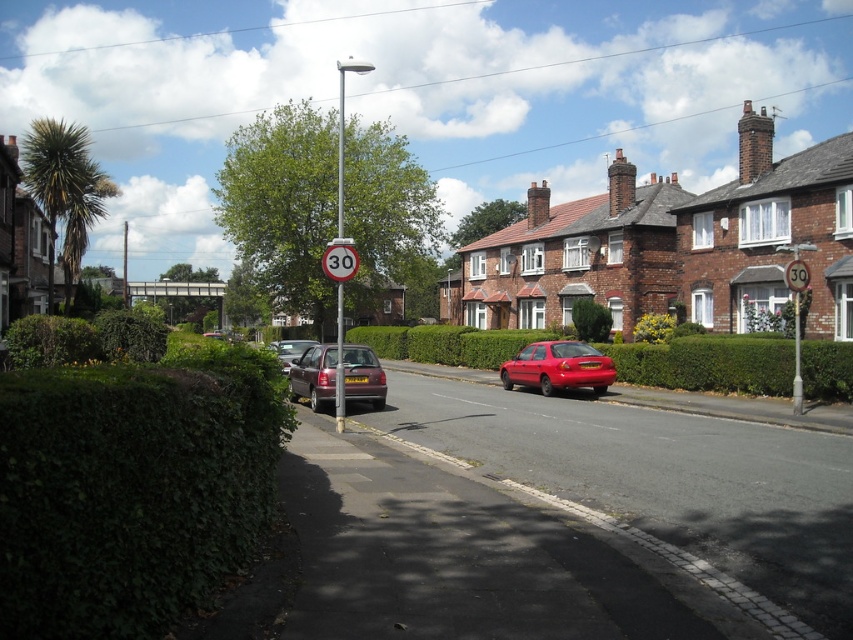
Can you confirm if metallic red speed limit sign at center is positioned to the left of metallic circular sign at center?

Indeed, metallic red speed limit sign at center is positioned on the left side of metallic circular sign at center.

Can you confirm if metallic red speed limit sign at center is positioned above metallic circular sign at center?

Incorrect, metallic red speed limit sign at center is not positioned above metallic circular sign at center.

Locate an element on the screen. Image resolution: width=853 pixels, height=640 pixels. metallic red speed limit sign at center is located at coordinates (339, 260).

Does matte red sedan at center come behind metallic red speed limit sign at center?

Yes, it is.

Who is more forward, [599,376] or [328,248]?

Point [328,248]

Find the location of a particular element. This screenshot has width=853, height=640. matte red sedan at center is located at coordinates (558, 368).

Does metallic silver car at center have a lesser width compared to metallic circular sign at center?

No, metallic silver car at center is not thinner than metallic circular sign at center.

From the picture: Who is taller, metallic silver car at center or metallic circular sign at center?

metallic silver car at center is taller.

Is point (270, 342) closer to viewer compared to point (805, 285)?

No, (270, 342) is behind (805, 285).

You are a GUI agent. You are given a task and a screenshot of the screen. Output one action in this format:
    pyautogui.click(x=<x>, y=<y>)
    Task: Click on the metallic silver car at center
    Image resolution: width=853 pixels, height=640 pixels.
    Given the screenshot: What is the action you would take?
    pyautogui.click(x=289, y=349)